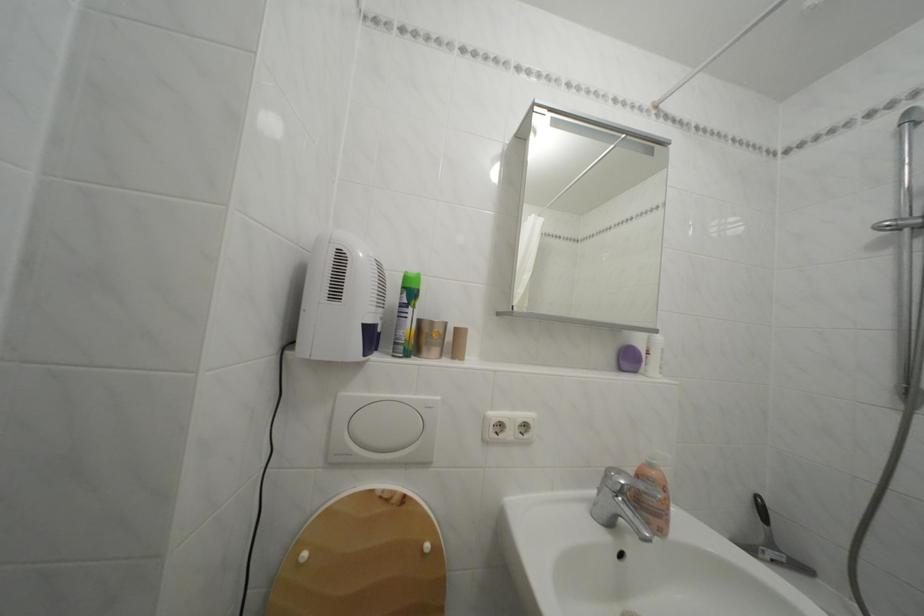
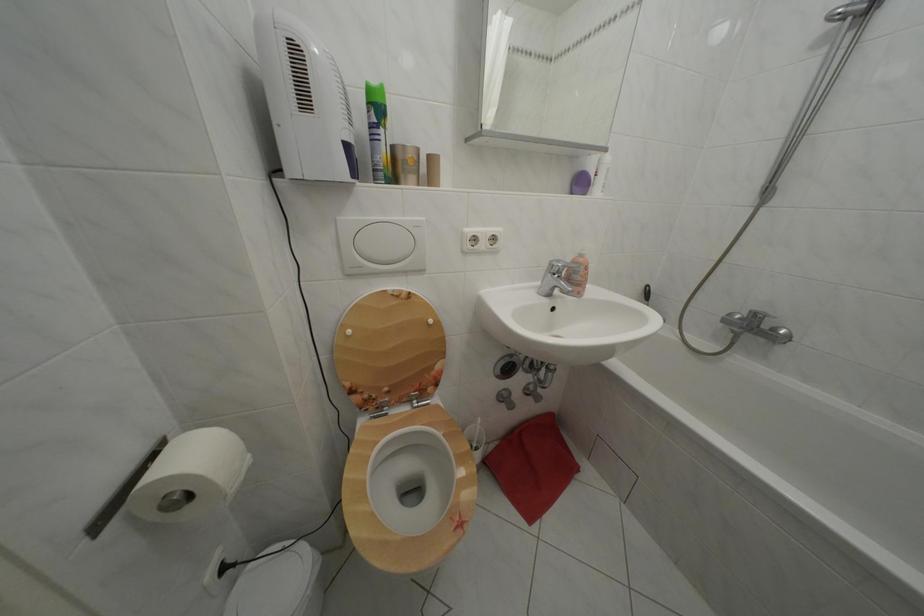
Where in the second image is the point corresponding to (350,400) from the first image?

(348, 225)